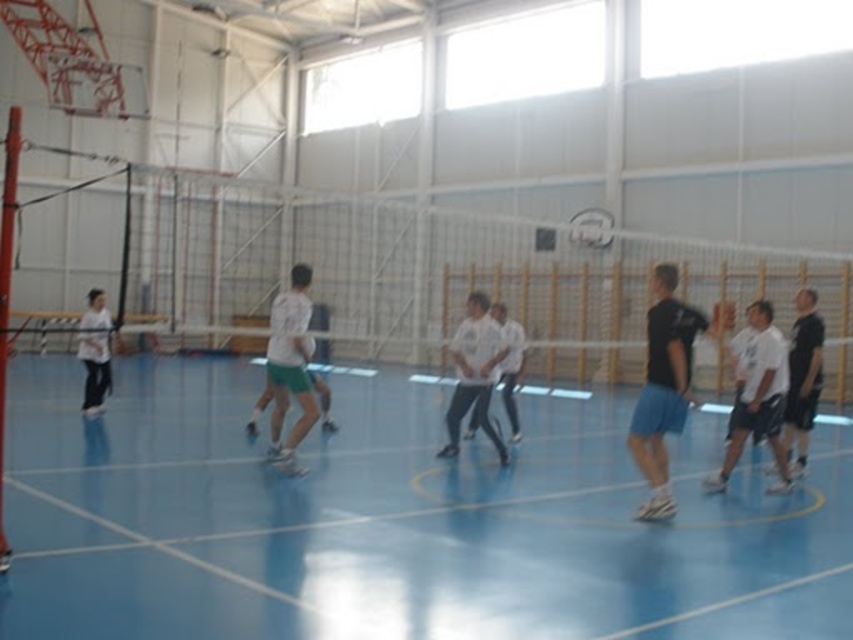
Between point (659, 300) and point (456, 333), which one is positioned in front?

Point (659, 300)

Does black matte shorts at right have a smaller size compared to white matte shirt at center?

Incorrect, black matte shorts at right is not smaller in size than white matte shirt at center.

Describe the element at coordinates (663, 387) in the screenshot. The width and height of the screenshot is (853, 640). I see `black matte shorts at right` at that location.

In order to click on black matte shorts at right in this screenshot , I will do `click(663, 387)`.

Is black matte shorts at right below white matte shorts at center?

Yes, black matte shorts at right is below white matte shorts at center.

Which is above, black matte shorts at right or white matte shorts at center?

white matte shorts at center is higher up.

This screenshot has height=640, width=853. Identify the location of black matte shorts at right. (663, 387).

Identify the location of black matte shorts at right. (663, 387).

Does white matte shirt at center appear on the left side of white matte shirt at right?

Indeed, white matte shirt at center is positioned on the left side of white matte shirt at right.

This screenshot has width=853, height=640. I want to click on white matte shirt at center, so click(474, 372).

This screenshot has height=640, width=853. I want to click on white matte shirt at center, so click(x=474, y=372).